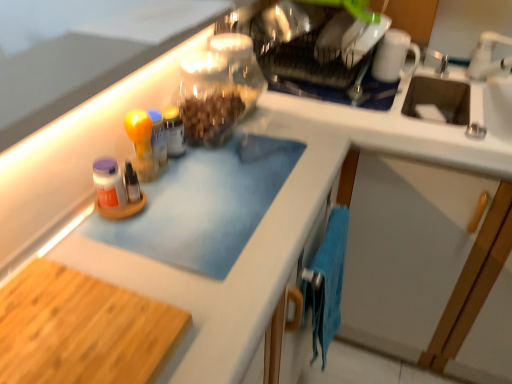
You are a GUI agent. You are given a task and a screenshot of the screen. Output one action in this format:
    pyautogui.click(x=<x>, y=<y>)
    Task: Click on the vacant space to the right of translucent glass jar at center
    The width and height of the screenshot is (512, 384).
    Given the screenshot: What is the action you would take?
    pyautogui.click(x=242, y=157)